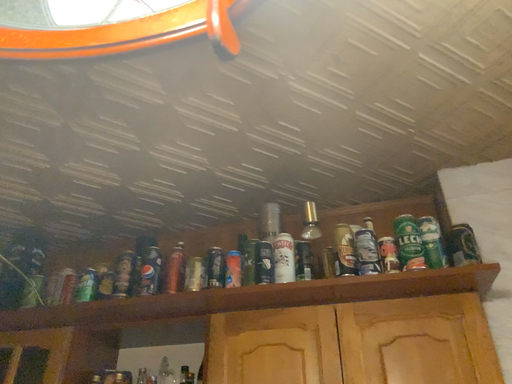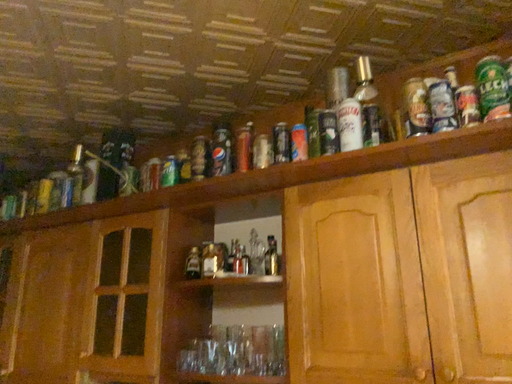
Question: Which way did the camera rotate in the video?

Choices:
 (A) rotated left
 (B) rotated right

Answer: (A)